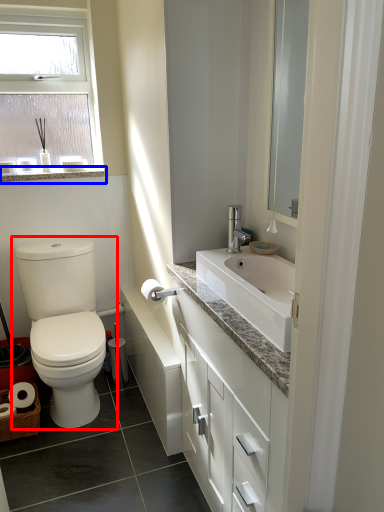
Question: Which of the following is the closest to the observer, toilet (highlighted by a red box) or window sill (highlighted by a blue box)?

Choices:
 (A) toilet
 (B) window sill

Answer: (A)